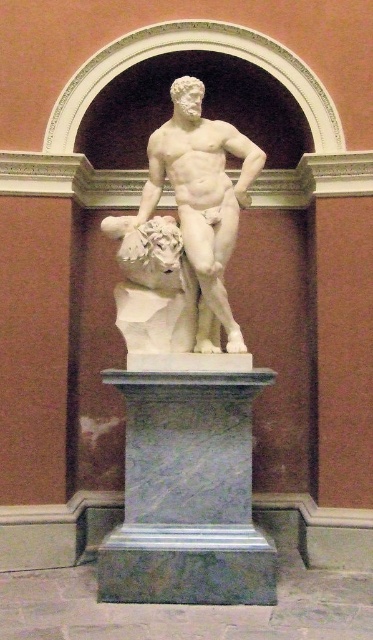
Is gray marble pedestal at center below white marble statue at center?

Indeed, gray marble pedestal at center is positioned under white marble statue at center.

Is gray marble pedestal at center thinner than white marble statue at center?

In fact, gray marble pedestal at center might be wider than white marble statue at center.

In order to click on gray marble pedestal at center in this screenshot , I will do `click(187, 493)`.

Where is `gray marble pedestal at center`? gray marble pedestal at center is located at coordinates [187, 493].